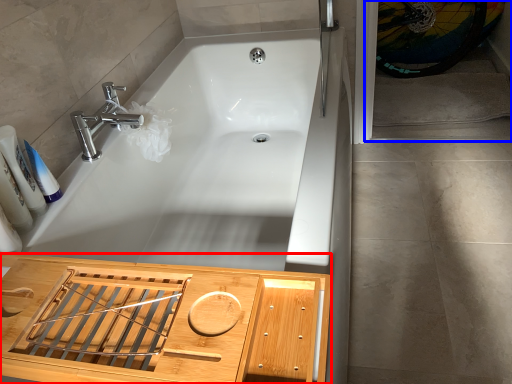
Question: Which of the following is the farthest to the observer, cabinetry (highlighted by a red box) or screen door (highlighted by a blue box)?

Choices:
 (A) cabinetry
 (B) screen door

Answer: (B)